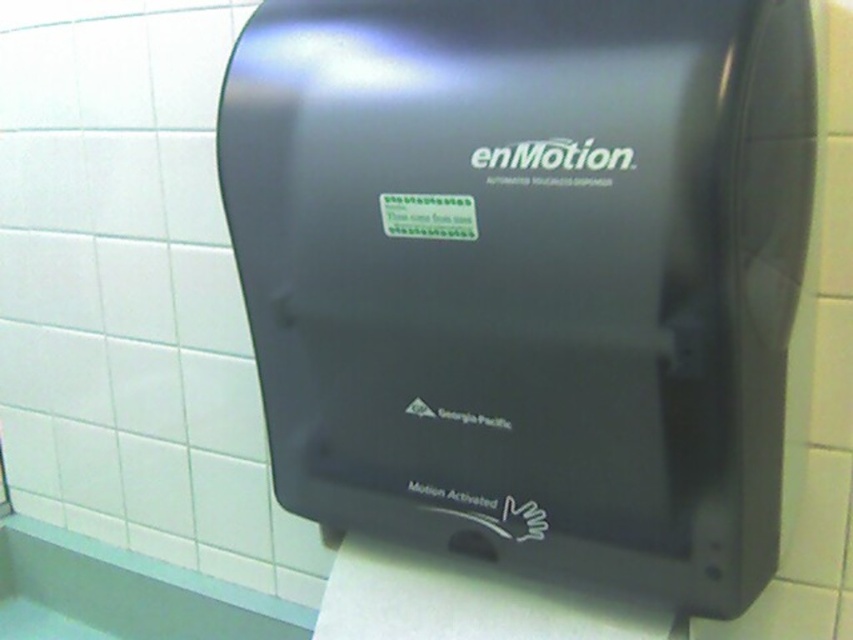
Question: Can you confirm if black plastic hand dryer at center is wider than white matte toilet paper at lower center?

Choices:
 (A) no
 (B) yes

Answer: (B)

Question: Does black plastic hand dryer at center appear over white matte toilet paper at lower center?

Choices:
 (A) yes
 (B) no

Answer: (A)

Question: Which of the following is the closest to the observer?

Choices:
 (A) (341, 291)
 (B) (410, 614)

Answer: (A)

Question: Among these objects, which one is farthest from the camera?

Choices:
 (A) white matte toilet paper at lower center
 (B) black plastic hand dryer at center

Answer: (A)

Question: Can you confirm if black plastic hand dryer at center is positioned above white matte toilet paper at lower center?

Choices:
 (A) yes
 (B) no

Answer: (A)